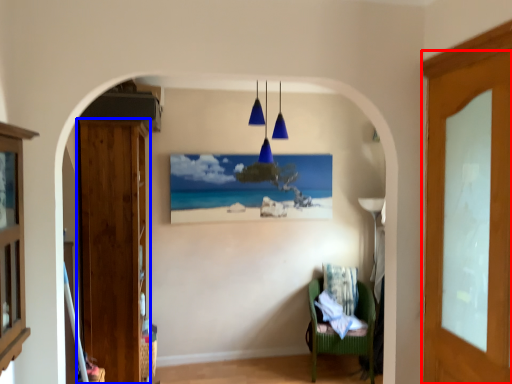
Question: Which object appears farthest to the camera in this image, door (highlighted by a red box) or door (highlighted by a blue box)?

Choices:
 (A) door
 (B) door

Answer: (B)